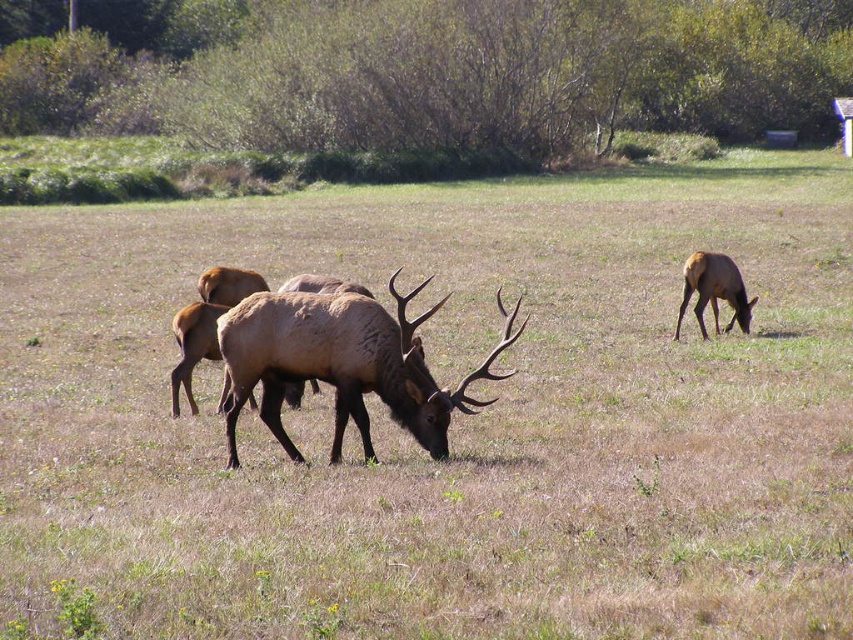
You are an animal researcher observing the elk in the image. You need to locate the brown velvet antlers at center for a study. Where exactly are they positioned in the image?

The brown velvet antlers at center are located at the coordinates point [341,364] in the image.